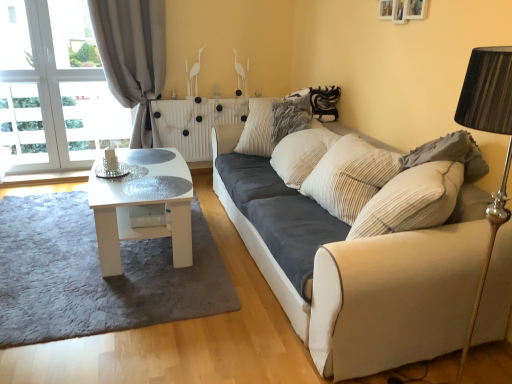
Question: Is white glossy coffee table at center located within gray textured pillow at right, which is counted as the 1th pillow, starting from the front?

Choices:
 (A) no
 (B) yes

Answer: (A)

Question: Is gray textured pillow at right, the first pillow in the right-to-left sequence, directly adjacent to white glossy coffee table at center?

Choices:
 (A) no
 (B) yes

Answer: (A)

Question: Does gray textured pillow at right, the first pillow in the right-to-left sequence, come in front of white glossy coffee table at center?

Choices:
 (A) no
 (B) yes

Answer: (B)

Question: Does gray textured pillow at right, the second pillow viewed from the left, have a greater height compared to white glossy coffee table at center?

Choices:
 (A) no
 (B) yes

Answer: (A)

Question: Considering the relative sizes of gray textured pillow at right, the second pillow when ordered from back to front, and white glossy coffee table at center in the image provided, is gray textured pillow at right, the second pillow when ordered from back to front, bigger than white glossy coffee table at center?

Choices:
 (A) no
 (B) yes

Answer: (A)

Question: Looking at their shapes, would you say gray fabric curtain at left is wider or thinner than gray shaggy rug at lower left?

Choices:
 (A) wide
 (B) thin

Answer: (B)

Question: From the image's perspective, is gray fabric curtain at left above or below gray shaggy rug at lower left?

Choices:
 (A) below
 (B) above

Answer: (B)

Question: Visually, is gray fabric curtain at left positioned to the left or to the right of gray shaggy rug at lower left?

Choices:
 (A) left
 (B) right

Answer: (B)

Question: From a real-world perspective, is gray fabric curtain at left above or below gray shaggy rug at lower left?

Choices:
 (A) below
 (B) above

Answer: (B)

Question: Is point (125, 193) closer or farther from the camera than point (166, 122)?

Choices:
 (A) closer
 (B) farther

Answer: (A)

Question: Considering the positions of transparent glass table at center and white marble radiator at center in the image, is transparent glass table at center bigger or smaller than white marble radiator at center?

Choices:
 (A) small
 (B) big

Answer: (A)

Question: Is transparent glass table at center in front of or behind white marble radiator at center in the image?

Choices:
 (A) front
 (B) behind

Answer: (A)

Question: In terms of width, does transparent glass table at center look wider or thinner when compared to white marble radiator at center?

Choices:
 (A) wide
 (B) thin

Answer: (A)

Question: In the image, is white glossy coffee table at center positioned in front of or behind gray shaggy rug at lower left?

Choices:
 (A) front
 (B) behind

Answer: (B)

Question: In terms of height, does white glossy coffee table at center look taller or shorter compared to gray shaggy rug at lower left?

Choices:
 (A) short
 (B) tall

Answer: (B)